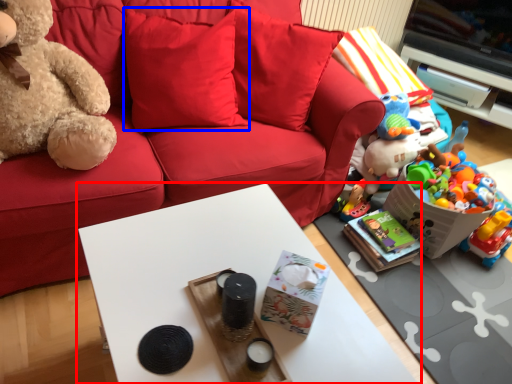
Question: Among these objects, which one is farthest to the camera, table (highlighted by a red box) or pillow (highlighted by a blue box)?

Choices:
 (A) table
 (B) pillow

Answer: (B)